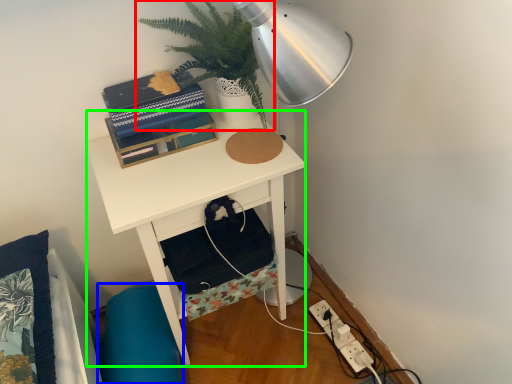
Question: Considering the real-world distances, which object is farthest from houseplant (highlighted by a red box)? swivel chair (highlighted by a blue box) or desk (highlighted by a green box)?

Choices:
 (A) swivel chair
 (B) desk

Answer: (A)